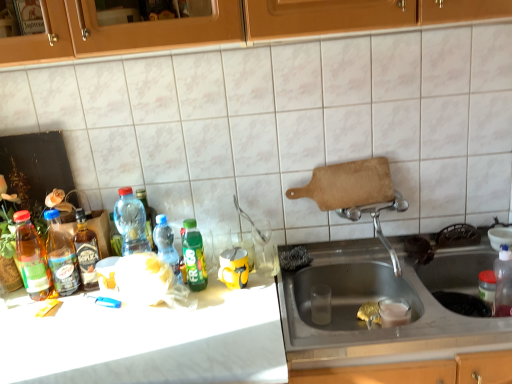
You are a GUI agent. You are given a task and a screenshot of the screen. Output one action in this format:
    pyautogui.click(x=<x>, y=<y>)
    Task: Click on the free space in front of green matte bottle at center, which is counted as the second bottle, starting from the right
    
    Given the screenshot: What is the action you would take?
    pyautogui.click(x=195, y=320)